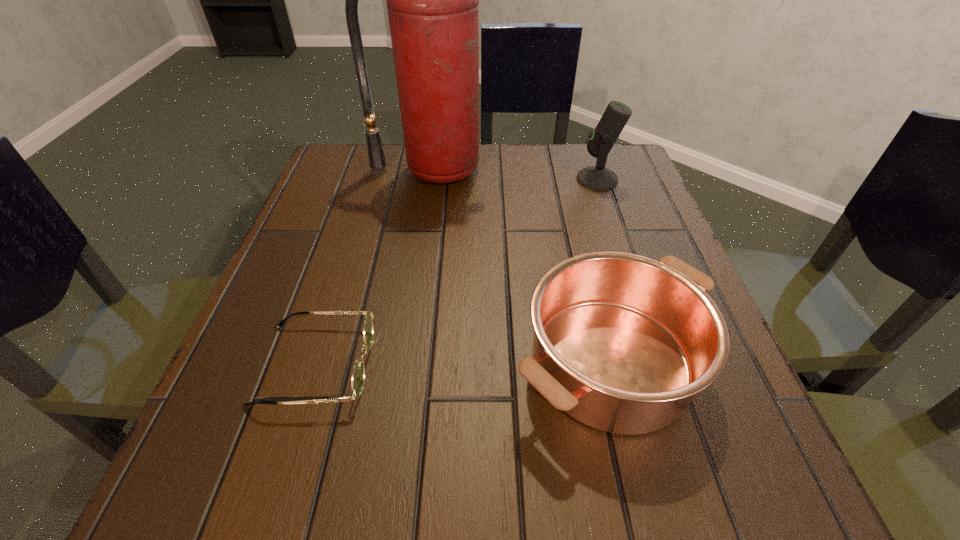
Image resolution: width=960 pixels, height=540 pixels. In the image, there is a desktop. Find the location of `vacant space at the left edge`. vacant space at the left edge is located at coordinates (279, 361).

The width and height of the screenshot is (960, 540). What are the coordinates of `vacant space at the far left corner of the desktop` in the screenshot? It's located at (321, 176).

At what (x,y) coordinates should I click in order to perform the action: click on vacant space at the far right corner of the desktop. Please return your answer as a coordinate pair (x, y). The height and width of the screenshot is (540, 960). Looking at the image, I should click on (630, 186).

You are a GUI agent. You are given a task and a screenshot of the screen. Output one action in this format:
    pyautogui.click(x=<x>, y=<y>)
    Task: Click on the vacant area at the near right corner
    
    Given the screenshot: What is the action you would take?
    pyautogui.click(x=684, y=489)

The width and height of the screenshot is (960, 540). In order to click on vacant space that's between the saucepan and the tallest object in this screenshot , I will do `click(521, 266)`.

The image size is (960, 540). What are the coordinates of `vacant point located between the fire extinguisher and the spectacles` in the screenshot? It's located at (373, 268).

Identify the location of empty space that is in between the tallest object and the second shortest object. The height and width of the screenshot is (540, 960). (521, 266).

At what (x,y) coordinates should I click in order to perform the action: click on free area in between the microphone and the spectacles. Please return your answer as a coordinate pair (x, y). The width and height of the screenshot is (960, 540). Looking at the image, I should click on (456, 272).

Locate an element on the screen. The width and height of the screenshot is (960, 540). blank region between the spectacles and the third tallest object is located at coordinates (463, 363).

This screenshot has width=960, height=540. I want to click on unoccupied position between the tallest object and the second tallest object, so click(x=515, y=175).